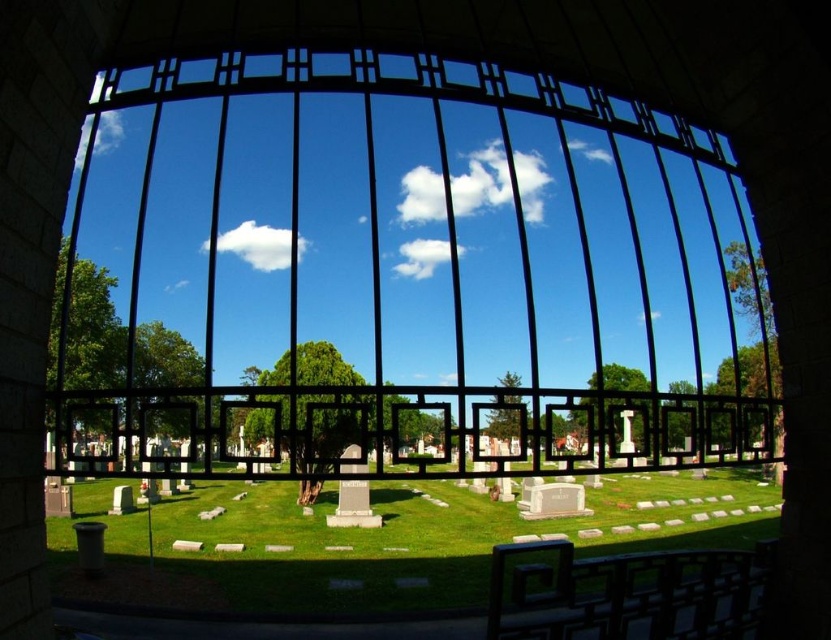
You are a gardener planning to mow the green grass at center. Considering the black metal gate at center is in the way, can you pass through the gate to mow the grass? Explain why based on their widths.

The black metal gate at center is wider than the green grass at center. Since the gate is wider, it should provide enough space for the gardener to pass through and mow the grass.

You are a gardener trying to mow the green grass at center. The black metal gate at center is in your way. Can you move the gate to access the grass?

The black metal gate at center is positioned over green grass at center, so you cannot move the gate to access the grass because it is already covering the grass.